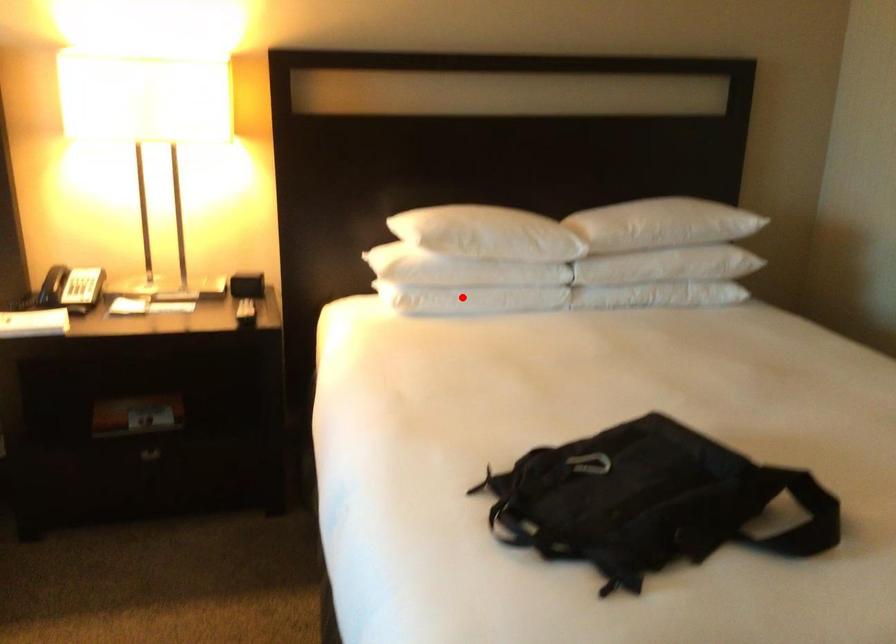
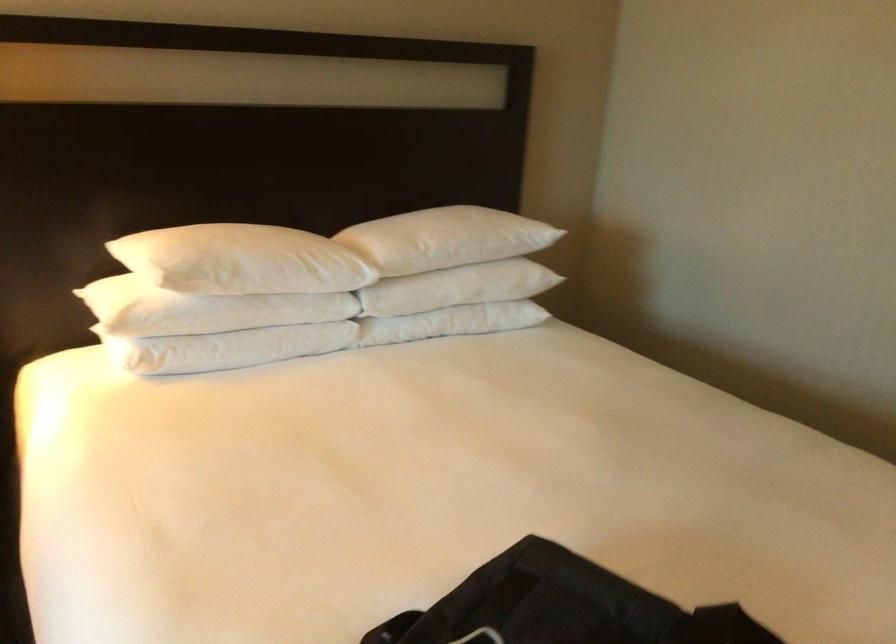
Question: I am providing you with two images of the same scene from different viewpoints. A red point is marked on the first image. At the location where the point appears in image 1, is it still visible in image 2?

Choices:
 (A) Yes
 (B) No

Answer: (A)